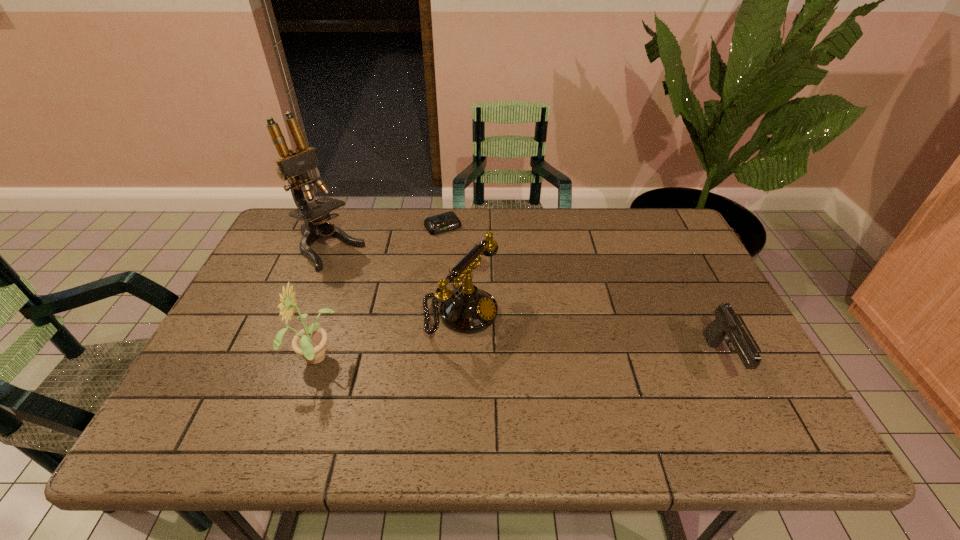
At what (x,y) coordinates should I click in order to perform the action: click on vacant space on the desktop that is between the sunflower and the fourth tallest object and is positioned at the eyepieces of the microscope. Please return your answer as a coordinate pair (x, y). This screenshot has width=960, height=540. Looking at the image, I should click on (483, 361).

This screenshot has width=960, height=540. What are the coordinates of `free space on the desktop that is between the sunflower and the rightmost object and is positioned on the display of the shortest object` in the screenshot? It's located at (543, 361).

I want to click on vacant space on the desktop that is between the sunflower and the fourth tallest object and is positioned on the dial of the third tallest object, so click(565, 361).